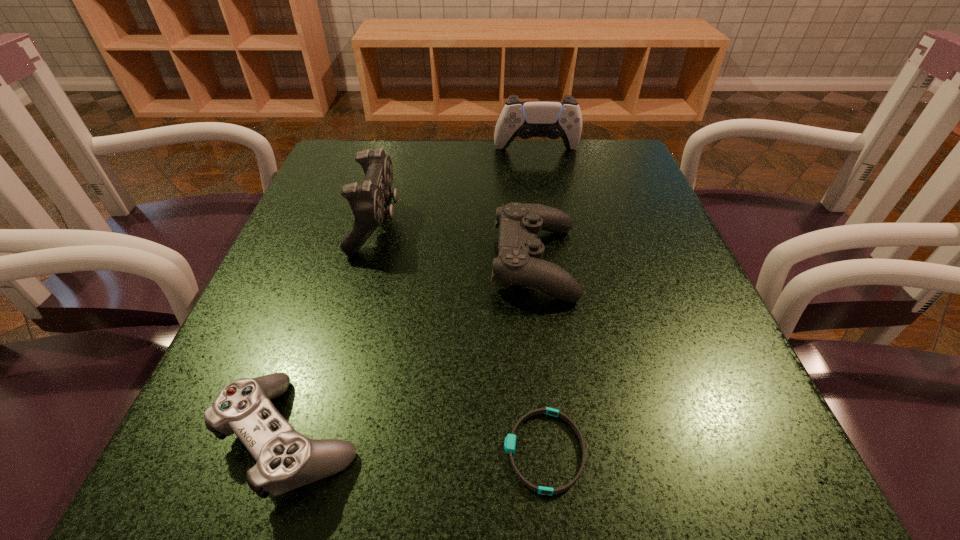
In the image, there is a desktop. Where is `vacant space at the right edge`? vacant space at the right edge is located at coordinates (683, 317).

The image size is (960, 540). In the image, there is a desktop. Identify the location of vacant area at the far left corner. (333, 189).

The image size is (960, 540). In order to click on free space between the third shortest object and the second shortest object in this screenshot , I will do `click(414, 349)`.

Identify the location of free space between the third tallest object and the shortest object. The image size is (960, 540). (540, 356).

Identify the location of vacant region between the third shortest object and the shortest object. The height and width of the screenshot is (540, 960). [540, 356].

Locate an element on the screen. Image resolution: width=960 pixels, height=540 pixels. vacant region between the nearest control and the wristband is located at coordinates (418, 444).

Where is `unoccupied area between the wristband and the second shortest control`? The width and height of the screenshot is (960, 540). unoccupied area between the wristband and the second shortest control is located at coordinates (540, 356).

You are a GUI agent. You are given a task and a screenshot of the screen. Output one action in this format:
    pyautogui.click(x=<x>, y=<y>)
    Task: Click on the closest object to the third tallest object
    The width and height of the screenshot is (960, 540).
    Given the screenshot: What is the action you would take?
    [368, 200]

Identify the location of object that is the second closest to the wristband. The width and height of the screenshot is (960, 540). (519, 262).

Image resolution: width=960 pixels, height=540 pixels. I want to click on control object that ranks as the closest to the farthest object, so click(368, 200).